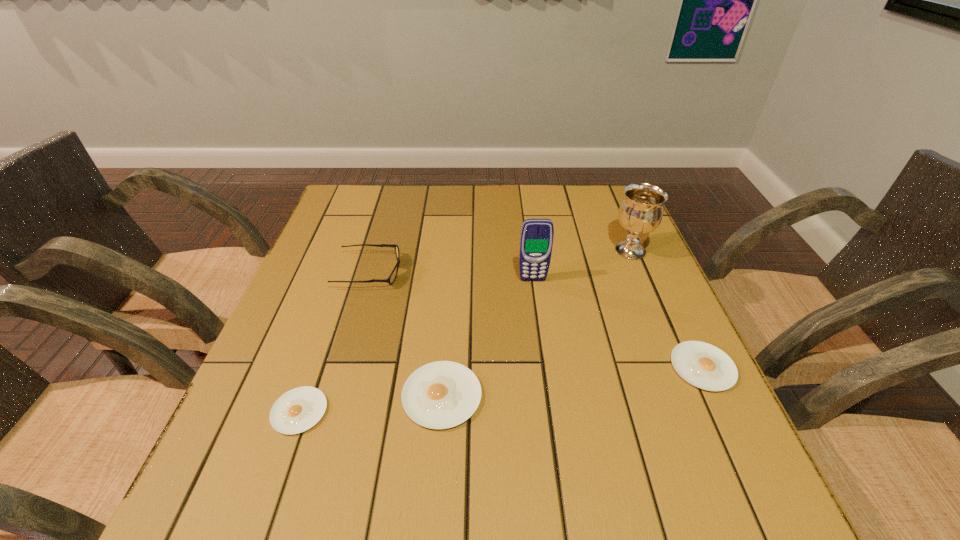
This screenshot has width=960, height=540. Find the location of `vacant space that satisfies the following two spatial constraints: 1. on the back side of the third object from left to right; 2. on the right side of the rightmost egg yolk`. vacant space that satisfies the following two spatial constraints: 1. on the back side of the third object from left to right; 2. on the right side of the rightmost egg yolk is located at coordinates (444, 367).

Locate an element on the screen. vacant position in the image that satisfies the following two spatial constraints: 1. on the back side of the shortest egg yolk; 2. on the right side of the rightmost egg yolk is located at coordinates (315, 367).